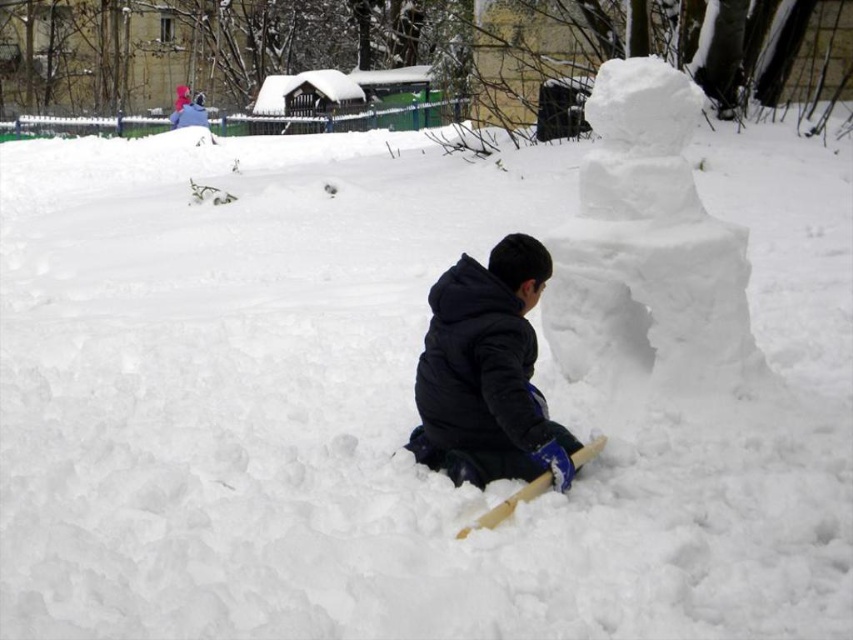
You are a photographer trying to capture the white fluffy snowman at upper right and the black fleece jacket at center in the same frame. Based on their sizes, which object would appear larger in the photo?

The white fluffy snowman at upper right would appear larger in the photo because it is much taller than the black fleece jacket at center.

You are a photographer trying to capture the white fluffy snowman at upper right and the black fleece jacket at center in the same frame. Based on their positions, which object would you need to focus on first if you want to ensure both are in focus?

The white fluffy snowman at upper right is located above the black fleece jacket at center. To capture both in focus, you should focus on the black fleece jacket at center first since it is closer to the camera, and the snowman will naturally fall into the depth of field if focused on the closer object.

You are a photographer trying to capture the snowman at upper right. The camera you are using has a focus point at coordinate point (648, 250). Will this focus point be on the snowman?

Yes, the point (648, 250) is on the white fluffy snowman at upper right, so the focus point will be on the snowman.